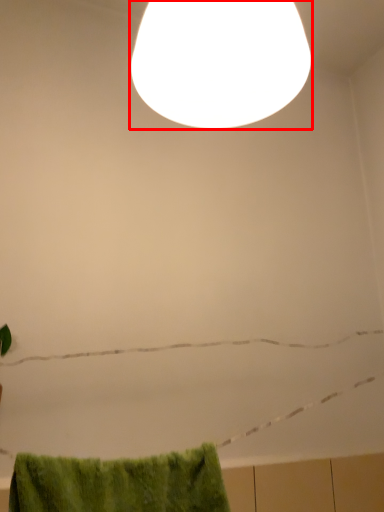
Question: From the image's perspective, where is lamp (annotated by the red box) located in relation to bath towel in the image?

Choices:
 (A) below
 (B) above

Answer: (B)